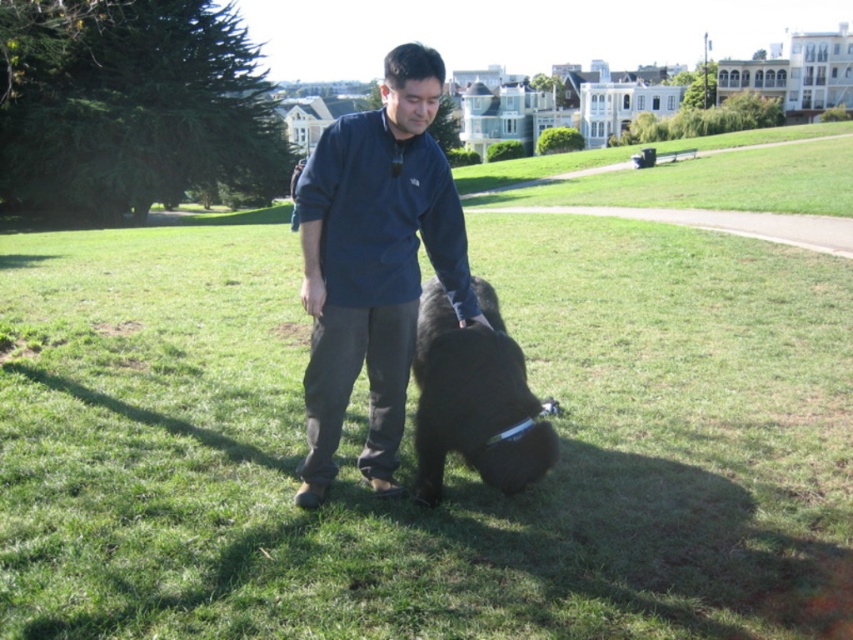
You are a photographer trying to capture a clear photo of the dark blue fleece at center and the black fur dog at center. Since you want both subjects to be in focus, you need to know their sizes relative to each other. Which one is bigger?

The dark blue fleece at center is larger in size than the black fur dog at center, so you should adjust your camera settings to focus on the larger object first to ensure both are in focus.

You are a photographer trying to capture a photo of the dark blue fleece at center and the black fur dog at center. Which object is taller in the scene?

The dark blue fleece at center is taller than the black fur dog at center.

You are a photographer trying to capture a photo of the dark blue fleece at center and the black fur dog at center. Since you want both subjects to be clearly visible in the frame, which one should you focus on first to ensure proper focus?

The dark blue fleece at center is positioned on the left side of black fur dog at center, so you should focus on the black fur dog at center first as it is closer to the center of the frame and more likely to be the main subject.